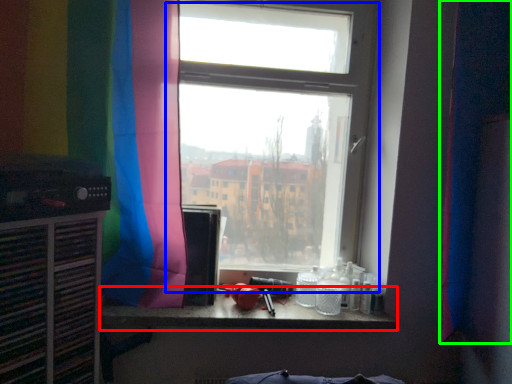
Question: Estimate the real-world distances between objects in this image. Which object is farther from counter top (highlighted by a red box), window (highlighted by a blue box) or curtain (highlighted by a green box)?

Choices:
 (A) window
 (B) curtain

Answer: (B)